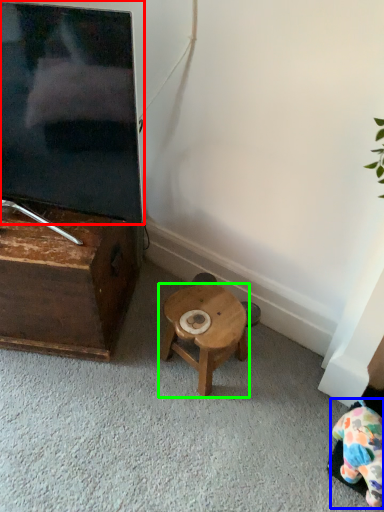
Question: Based on their relative distances, which object is farther from television (highlighted by a red box)? Choose from toy (highlighted by a blue box) and stool (highlighted by a green box).

Choices:
 (A) toy
 (B) stool

Answer: (A)